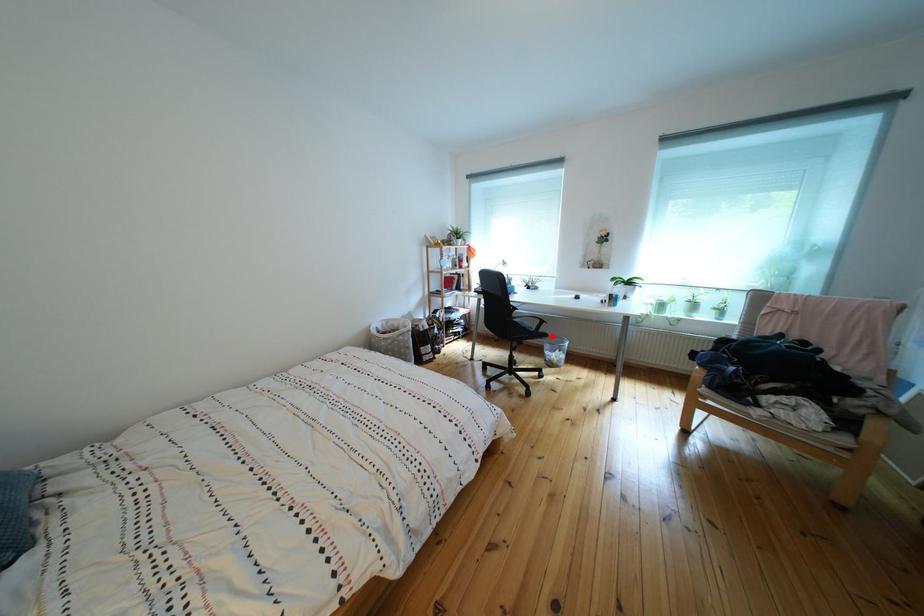
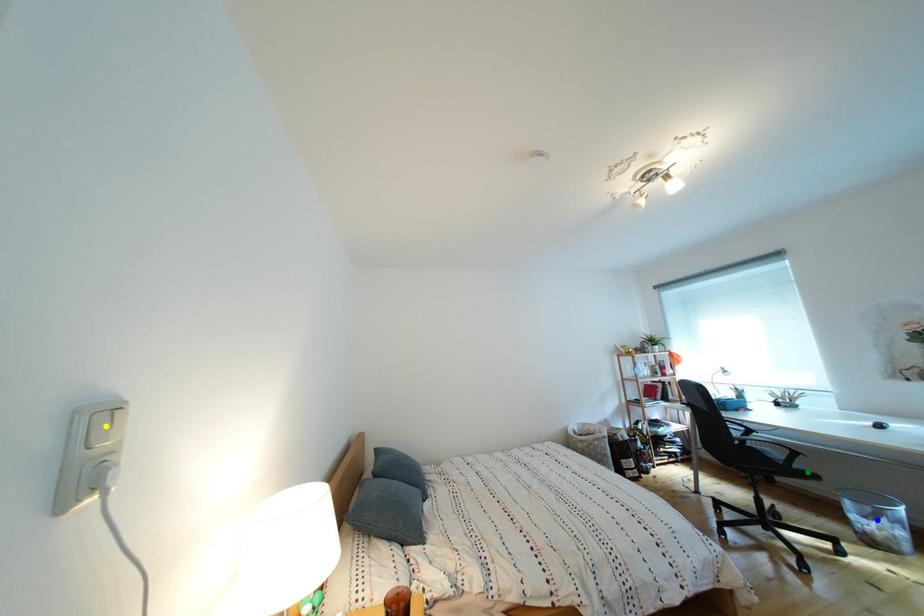
Question: I am providing you with two images of the same scene from different viewpoints. A red point is marked on the first image. You are given multiple points on the second image. Which mark in image 2 goes with the point in image 1?

Choices:
 (A) blue point
 (B) green point
 (C) yellow point

Answer: (B)